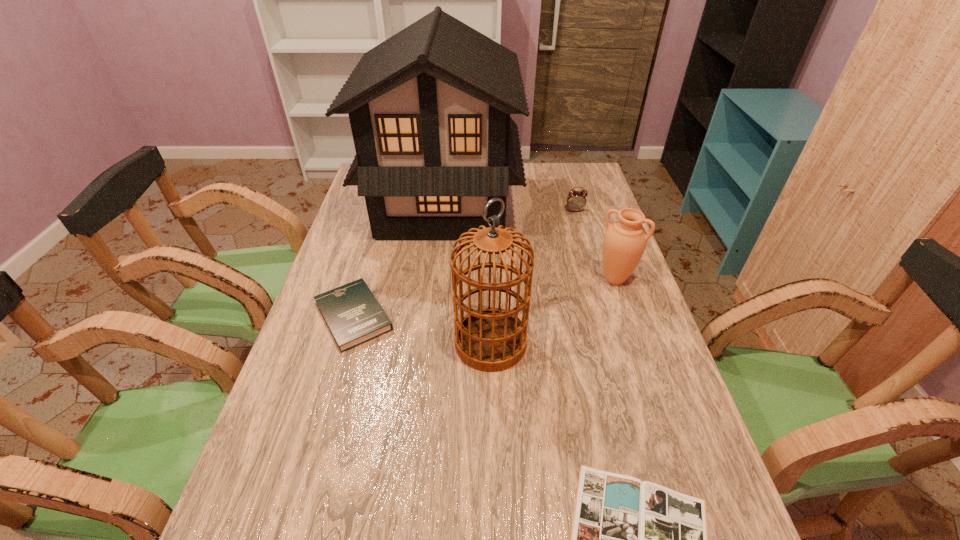
The width and height of the screenshot is (960, 540). What are the coordinates of `vacant region located on the front of the left book` in the screenshot? It's located at (314, 453).

The width and height of the screenshot is (960, 540). I want to click on object that is at the far edge, so click(429, 108).

Where is `dollhouse at the left edge`? The image size is (960, 540). dollhouse at the left edge is located at coordinates (429, 108).

The width and height of the screenshot is (960, 540). Find the location of `book present at the left edge`. book present at the left edge is located at coordinates (353, 315).

Find the location of a particular element. The image size is (960, 540). urn that is positioned at the right edge is located at coordinates (625, 240).

Where is `alarm clock at the right edge`? Image resolution: width=960 pixels, height=540 pixels. alarm clock at the right edge is located at coordinates (576, 200).

Locate an element on the screen. The image size is (960, 540). object that is at the far left corner is located at coordinates (429, 108).

The height and width of the screenshot is (540, 960). In the image, there is a desktop. Find the location of `free space at the far edge`. free space at the far edge is located at coordinates (529, 187).

The image size is (960, 540). In order to click on free region at the left edge of the desktop in this screenshot , I will do `click(281, 471)`.

Identify the location of vacant space at the far right corner of the desktop. The image size is (960, 540). (556, 187).